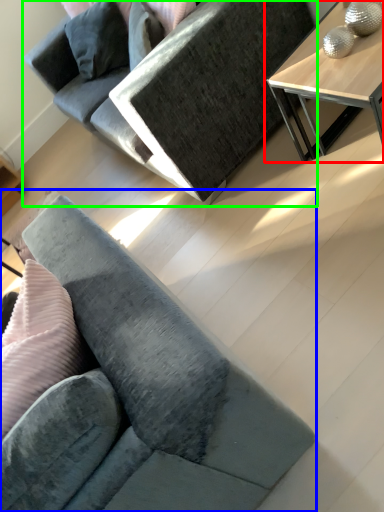
Question: Which object is the closest to the table (highlighted by a red box)? Choose among these: studio couch (highlighted by a blue box) or studio couch (highlighted by a green box).

Choices:
 (A) studio couch
 (B) studio couch

Answer: (B)